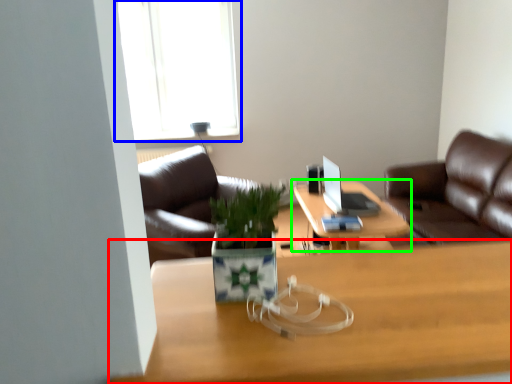
Question: Based on their relative distances, which object is nearer to desk (highlighted by a red box)? Choose from window (highlighted by a blue box) and table (highlighted by a green box).

Choices:
 (A) window
 (B) table

Answer: (B)